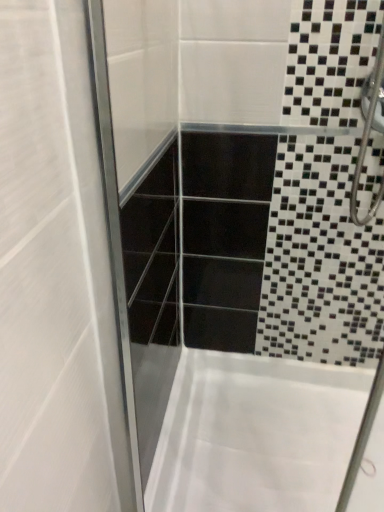
I want to click on white fabric bathtub at lower center, so click(x=256, y=434).

Describe the element at coordinates (256, 434) in the screenshot. The height and width of the screenshot is (512, 384). I see `white fabric bathtub at lower center` at that location.

Find the location of a particular element. This screenshot has height=512, width=384. white fabric bathtub at lower center is located at coordinates [x=256, y=434].